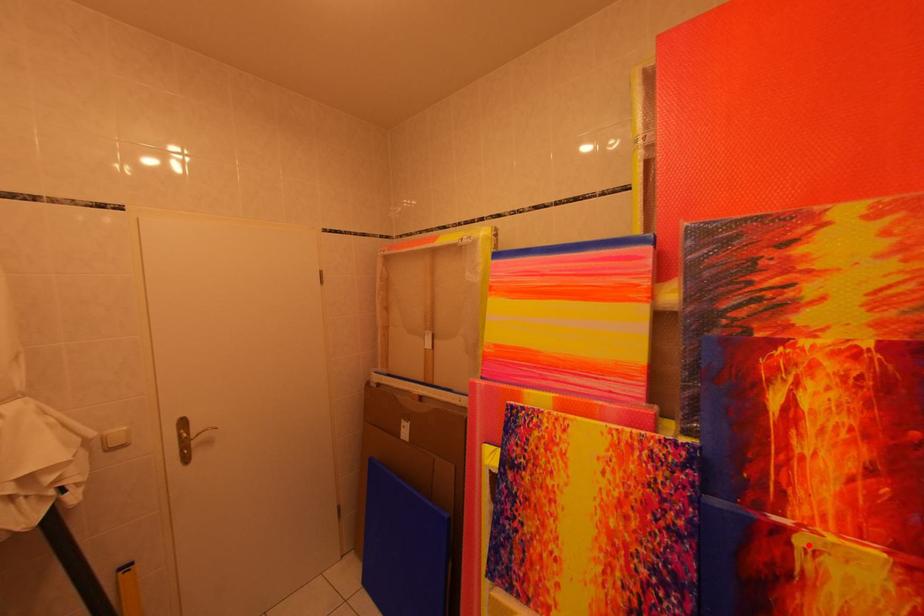
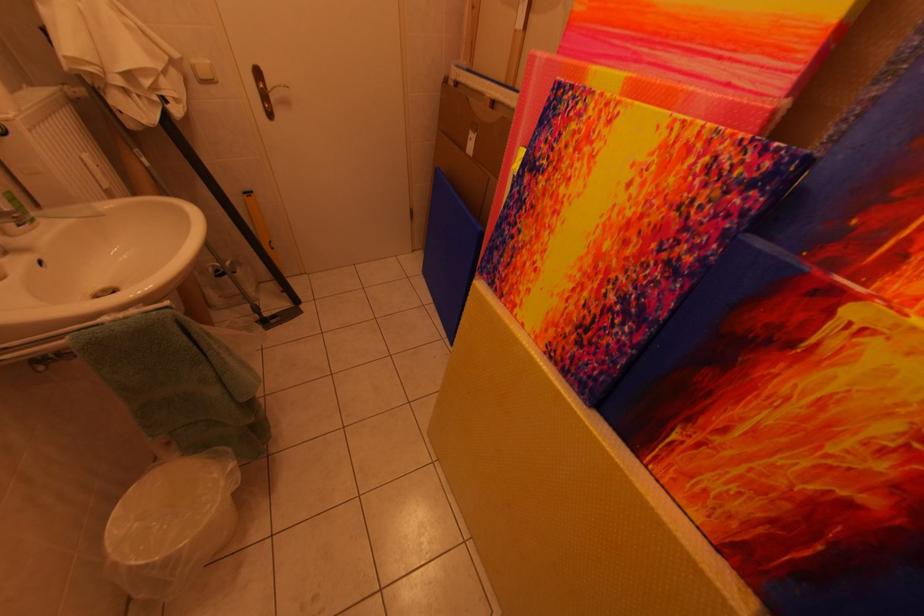
Find the pixel in the second image that matches the highlighted location in the first image.

(861, 317)